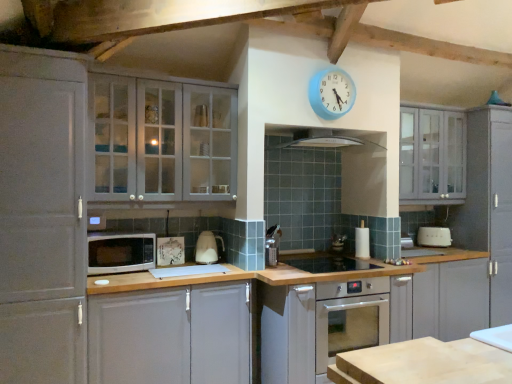
This screenshot has height=384, width=512. Find the location of `blank space above white plastic toaster at right, the 1th appliance viewed from the right (from a real-world perspective)`. blank space above white plastic toaster at right, the 1th appliance viewed from the right (from a real-world perspective) is located at coordinates (431, 222).